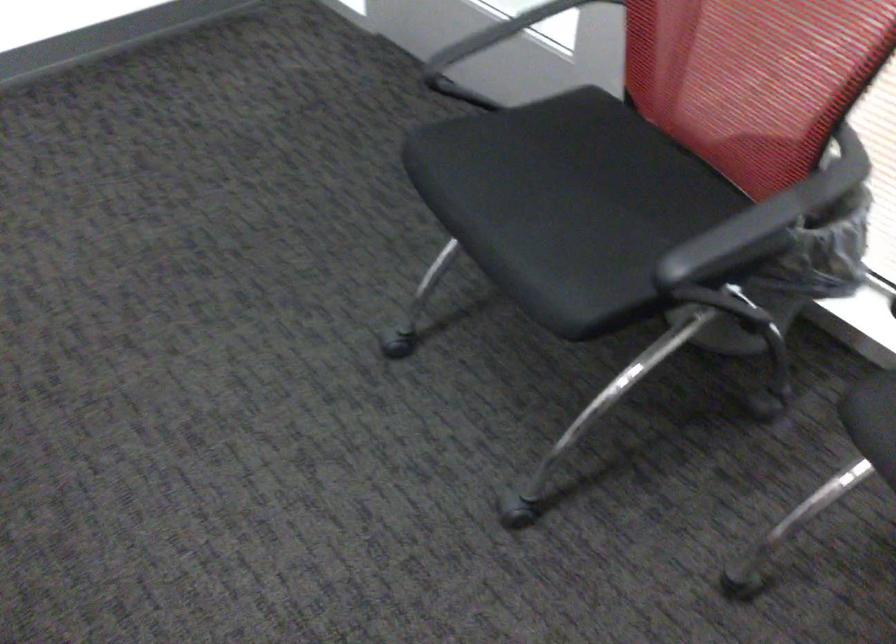
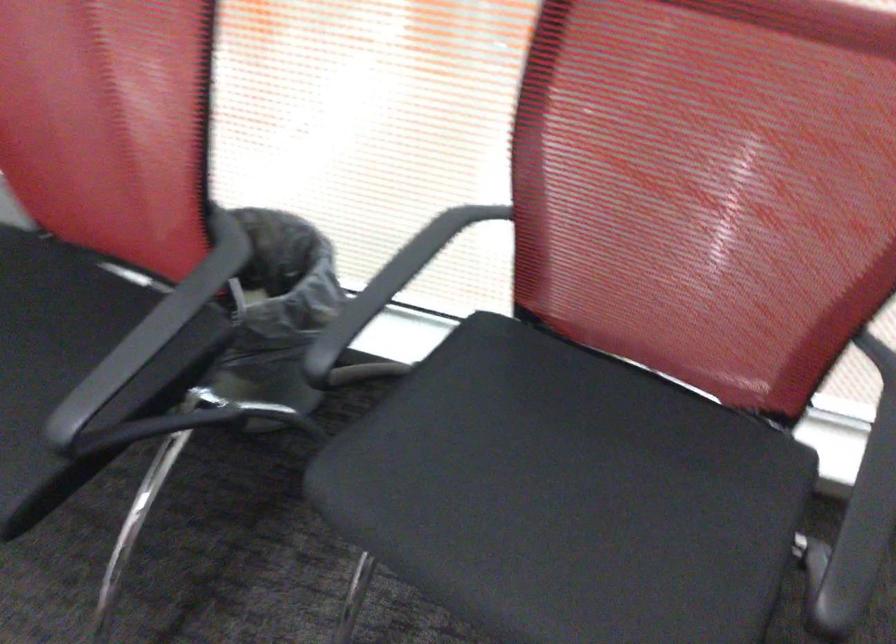
Question: The camera is either moving clockwise (left) or counter-clockwise (right) around the object. The first image is from the beginning of the video and the second image is from the end. Is the camera moving left or right when shooting the video?

Choices:
 (A) Left
 (B) Right

Answer: (A)